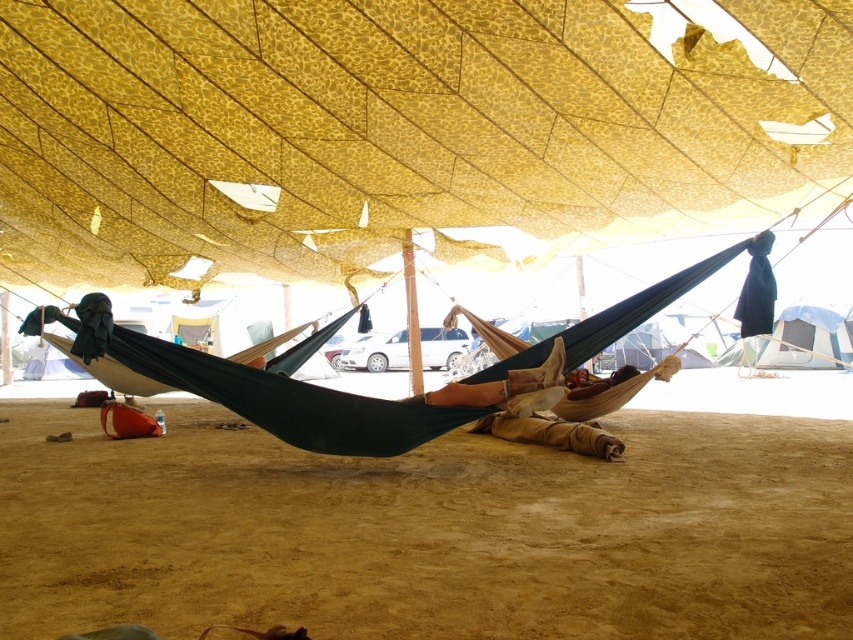
You are planning to set up a picnic under the yellow mesh canopy at center and the white canvas tent at upper right. Which structure offers a wider area to spread out your picnic items?

The white canvas tent at upper right has a greater width than the yellow mesh canopy at center, so it offers a wider area for spreading out picnic items.